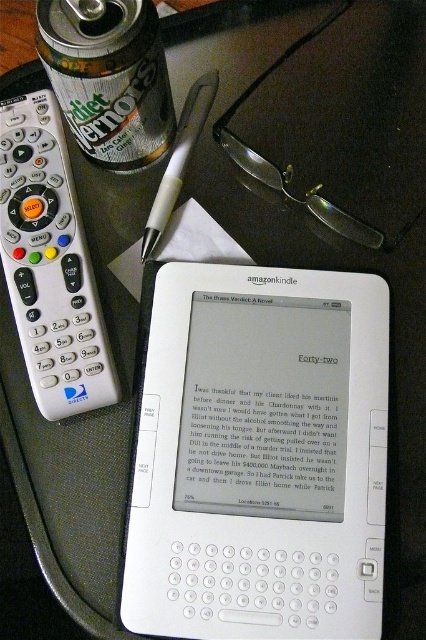
Who is positioned more to the right, white plastic kindle at center or diet orange aluminum can at upper left?

From the viewer's perspective, white plastic kindle at center appears more on the right side.

Measure the distance between white plastic kindle at center and diet orange aluminum can at upper left.

A distance of 15.38 inches exists between white plastic kindle at center and diet orange aluminum can at upper left.

Who is more distant from viewer, (166, 304) or (155, 112)?

The point (155, 112) is behind.

Image resolution: width=426 pixels, height=640 pixels. What are the coordinates of `white plastic kindle at center` in the screenshot? It's located at (259, 456).

Is white plastic remote at left taller than white plastic pen at center?

Yes.

Can you confirm if white plastic remote at left is positioned above white plastic pen at center?

Incorrect, white plastic remote at left is not positioned above white plastic pen at center.

Is point (23, 276) more distant than point (143, 240)?

No, (23, 276) is in front of (143, 240).

Where is `white plastic remote at left`? Image resolution: width=426 pixels, height=640 pixels. white plastic remote at left is located at coordinates (49, 262).

Which is below, white plastic remote at left or diet orange aluminum can at upper left?

white plastic remote at left

Which is more to the left, white plastic remote at left or diet orange aluminum can at upper left?

From the viewer's perspective, white plastic remote at left appears more on the left side.

Describe the element at coordinates (49, 262) in the screenshot. This screenshot has height=640, width=426. I see `white plastic remote at left` at that location.

Find the location of a particular element. white plastic remote at left is located at coordinates [x=49, y=262].